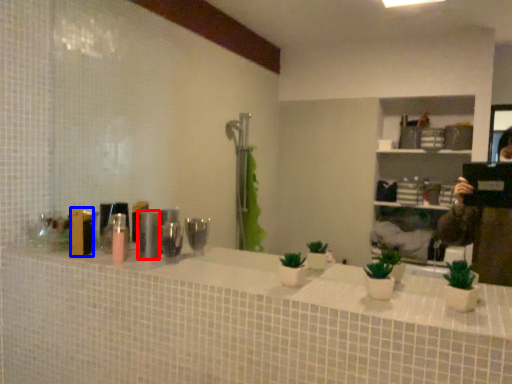
Question: Among these objects, which one is farthest to the camera, toiletry (highlighted by a red box) or toiletry (highlighted by a blue box)?

Choices:
 (A) toiletry
 (B) toiletry

Answer: (B)